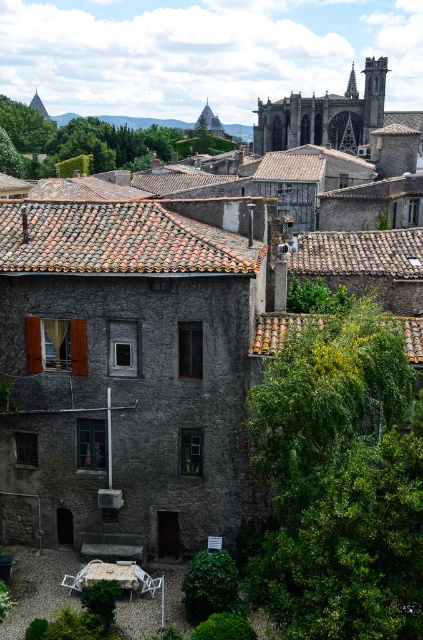
Question: Which object is farther from the camera taking this photo?

Choices:
 (A) green leafy tree at lower right
 (B) green leafy tree at upper center

Answer: (B)

Question: Does green leafy tree at lower right appear on the right side of green leafy tree at upper center?

Choices:
 (A) yes
 (B) no

Answer: (A)

Question: Does green leafy tree at lower right have a smaller size compared to green leafy tree at upper center?

Choices:
 (A) no
 (B) yes

Answer: (B)

Question: Is green leafy tree at lower right in front of green leafy tree at upper center?

Choices:
 (A) yes
 (B) no

Answer: (A)